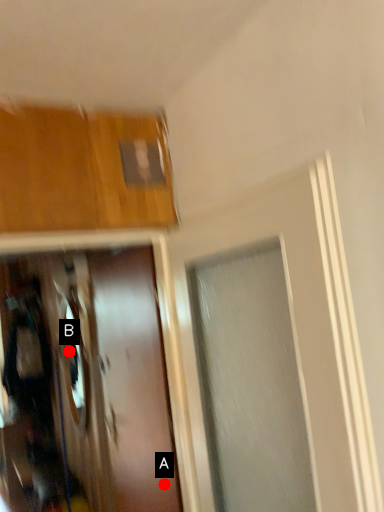
Question: Two points are circled on the image, labeled by A and B beside each circle. Which point is farther from the camera taking this photo?

Choices:
 (A) A is further
 (B) B is further

Answer: (B)